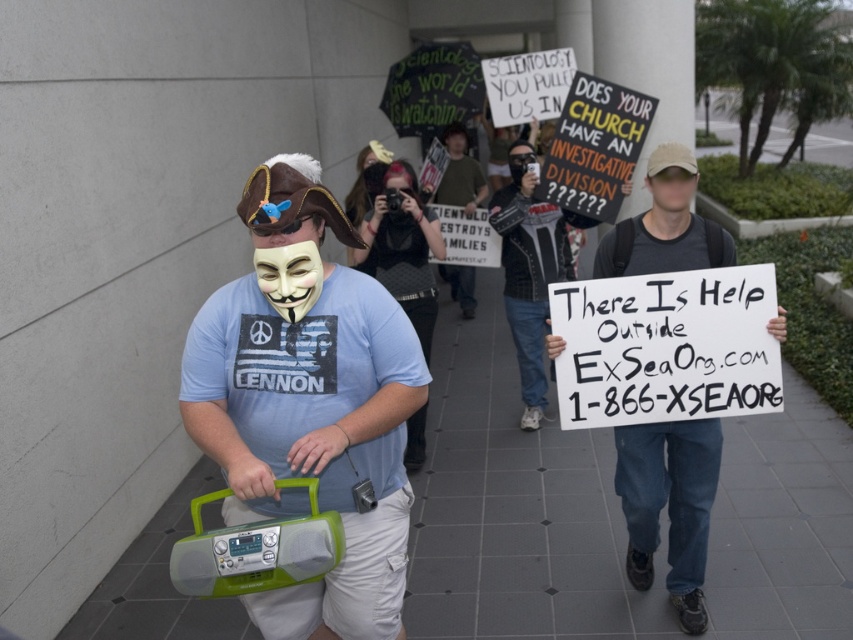
What are the coordinates of the green plastic boombox at center?

The green plastic boombox at center is located at coordinates point (309,403).

You are a photographer trying to capture the green plastic boombox at center and the white paper sign at center in a single shot. Which object will appear larger in your photo?

The green plastic boombox at center will appear larger in the photo because it is closer to the viewer than the white paper sign at center.

You are a photographer capturing the scene from the front. You notice the green plastic boombox at center and the white paper sign at center. Which object is closer to the left side of your camera frame?

The green plastic boombox at center is closer to the left side of the camera frame because it is positioned to the left of the white paper sign at center.